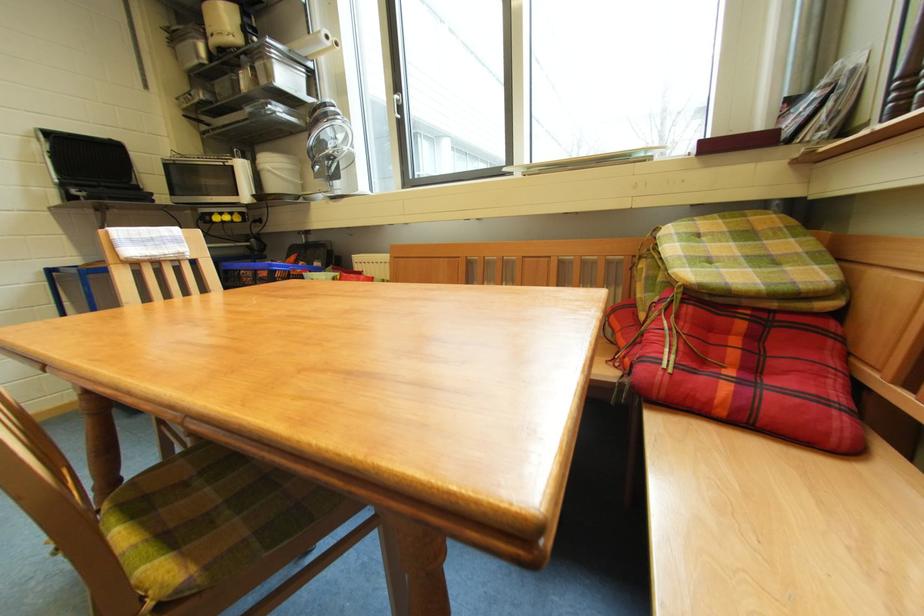
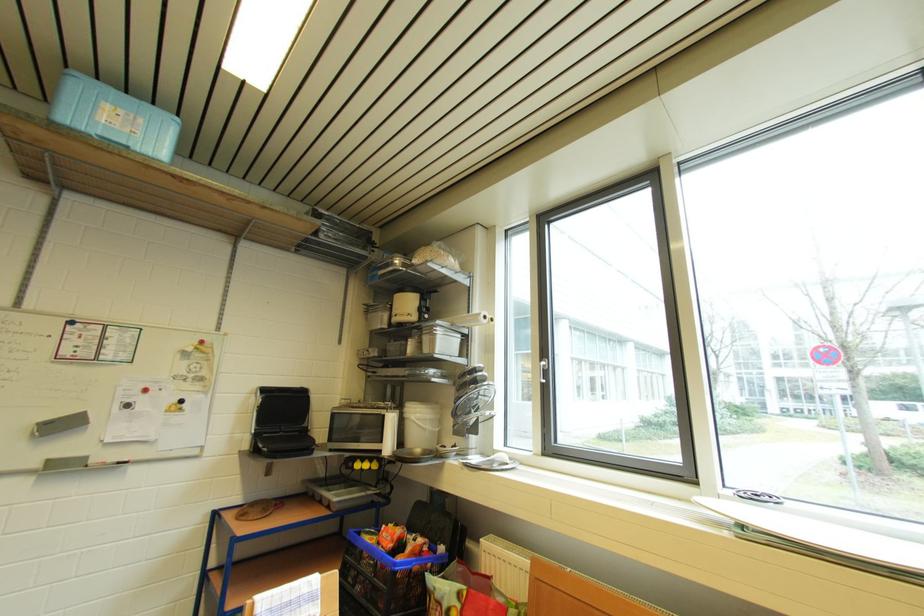
The first image is from the beginning of the video and the second image is from the end. How did the camera likely rotate when shooting the video?

The rotation direction of the camera is left-up.